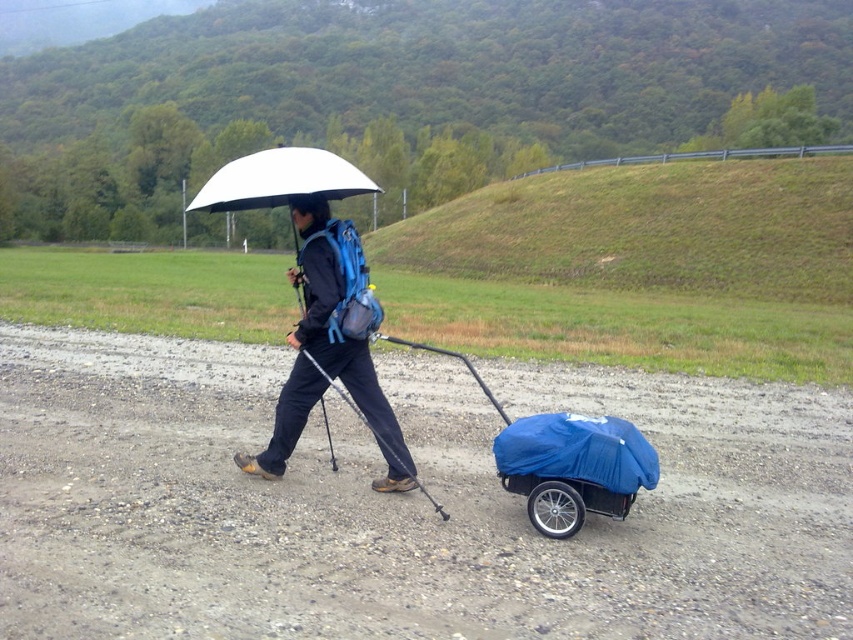
Who is higher up, blue fabric cart at center or white matte umbrella at upper center?

Positioned higher is white matte umbrella at upper center.

How much distance is there between blue fabric cart at center and white matte umbrella at upper center?

blue fabric cart at center is 27.19 meters away from white matte umbrella at upper center.

Is point (608, 460) more distant than point (274, 161)?

No.

You are a GUI agent. You are given a task and a screenshot of the screen. Output one action in this format:
    pyautogui.click(x=<x>, y=<y>)
    Task: Click on the blue fabric cart at center
    The width and height of the screenshot is (853, 640).
    Given the screenshot: What is the action you would take?
    pyautogui.click(x=564, y=460)

In the scene shown: Can you confirm if matte black jacket at center is positioned to the left of white matte umbrella at upper center?

No, matte black jacket at center is not to the left of white matte umbrella at upper center.

Is matte black jacket at center wider than white matte umbrella at upper center?

No, matte black jacket at center is not wider than white matte umbrella at upper center.

The width and height of the screenshot is (853, 640). Identify the location of matte black jacket at center. (346, 356).

Between point (177, 620) and point (608, 422), which one is positioned behind?

Positioned behind is point (608, 422).

Between dirt gravel at center and blue fabric cart at center, which one appears on the right side from the viewer's perspective?

From the viewer's perspective, blue fabric cart at center appears more on the right side.

What are the coordinates of `dirt gravel at center` in the screenshot? It's located at (399, 504).